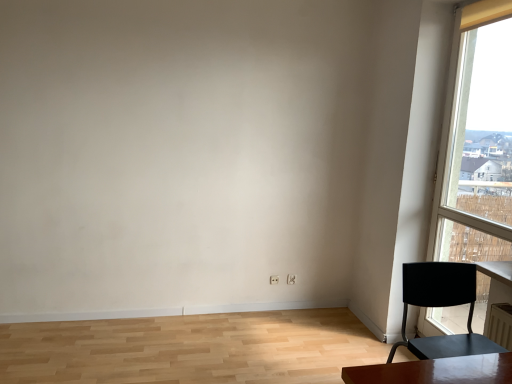
What do you see at coordinates (442, 306) in the screenshot? I see `matte black chair at right` at bounding box center [442, 306].

Measure the distance between point (410, 269) and camera.

The distance of point (410, 269) from camera is 5.73 feet.

Where is `matte black chair at right`? This screenshot has width=512, height=384. matte black chair at right is located at coordinates (442, 306).

The width and height of the screenshot is (512, 384). I want to click on transparent glass window at right, so click(x=476, y=140).

What do you see at coordinates (476, 140) in the screenshot?
I see `transparent glass window at right` at bounding box center [476, 140].

This screenshot has height=384, width=512. I want to click on matte black chair at right, so click(x=442, y=306).

Visually, is transparent glass window at right positioned to the left or to the right of matte black chair at right?

transparent glass window at right is positioned on matte black chair at right's right side.

Considering the relative positions of transparent glass window at right and matte black chair at right in the image provided, is transparent glass window at right behind matte black chair at right?

Yes, it is.

In the scene shown: Which point is more forward, (450, 76) or (424, 352)?

The point (424, 352) is closer.

From the image's perspective, is transparent glass window at right on top of matte black chair at right?

Yes.

From a real-world perspective, which object stands above the other?

In real-world perspective, transparent glass window at right is above.

Considering the relative sizes of transparent glass window at right and matte black chair at right in the image provided, is transparent glass window at right thinner than matte black chair at right?

Yes.

Between transparent glass window at right and matte black chair at right, which one has more height?

transparent glass window at right is taller.

Which of these two, transparent glass window at right or matte black chair at right, is bigger?

With larger size is transparent glass window at right.

Is transparent glass window at right located outside matte black chair at right?

transparent glass window at right lies outside matte black chair at right's area.

Is transparent glass window at right not near matte black chair at right?

Indeed, transparent glass window at right is not near matte black chair at right.

Could you tell me if transparent glass window at right is turned towards matte black chair at right?

No, transparent glass window at right does not turn towards matte black chair at right.

How many degrees apart are the facing directions of transparent glass window at right and matte black chair at right?

90 degrees.

Where is `window above the matte black chair at right (from a real-world perspective)`? This screenshot has height=384, width=512. window above the matte black chair at right (from a real-world perspective) is located at coordinates (476, 140).

Which is more to the left, matte black chair at right or transparent glass window at right?

From the viewer's perspective, matte black chair at right appears more on the left side.

Which object is closer to the camera taking this photo, matte black chair at right or transparent glass window at right?

Positioned in front is matte black chair at right.

Considering the positions of points (449, 305) and (453, 96), is point (449, 305) farther from camera compared to point (453, 96)?

No, (449, 305) is closer to viewer.

From the image's perspective, would you say matte black chair at right is positioned over transparent glass window at right?

No.

From a real-world perspective, who is located higher, matte black chair at right or transparent glass window at right?

From a 3D spatial view, transparent glass window at right is above.

Considering the relative sizes of matte black chair at right and transparent glass window at right in the image provided, is matte black chair at right thinner than transparent glass window at right?

No.

From the picture: Does matte black chair at right have a lesser height compared to transparent glass window at right?

Yes.

Can you confirm if matte black chair at right is bigger than transparent glass window at right?

No, matte black chair at right is not bigger than transparent glass window at right.

Is matte black chair at right not within transparent glass window at right?

Yes, matte black chair at right is outside of transparent glass window at right.

Is matte black chair at right not near transparent glass window at right?

Indeed, matte black chair at right is not near transparent glass window at right.

Is matte black chair at right looking in the opposite direction of transparent glass window at right?

No, matte black chair at right is not facing the opposite direction of transparent glass window at right.

How many degrees apart are the facing directions of matte black chair at right and transparent glass window at right?

90 degrees separate the facing orientations of matte black chair at right and transparent glass window at right.

How far apart are matte black chair at right and transparent glass window at right?

The distance of matte black chair at right from transparent glass window at right is 4.48 feet.

Identify the location of window above the matte black chair at right (from a real-world perspective). (476, 140).

Where is `chair lying on the left of transparent glass window at right`? chair lying on the left of transparent glass window at right is located at coordinates (442, 306).

Identify the location of chair in front of the transparent glass window at right. (442, 306).